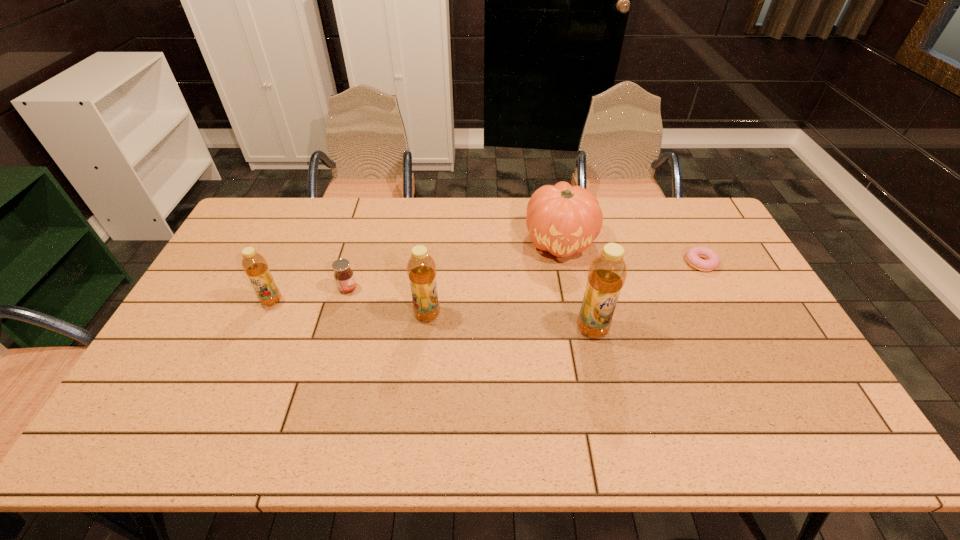
Where is `unoccupied position between the shortest bottle and the rightmost object`? The image size is (960, 540). unoccupied position between the shortest bottle and the rightmost object is located at coordinates (486, 281).

The image size is (960, 540). In order to click on free space between the second shortest object and the tallest bottle in this screenshot , I will do `click(470, 309)`.

Find the location of a particular element. free spot between the pumpkin and the second tallest object is located at coordinates (493, 278).

This screenshot has width=960, height=540. In order to click on object that stands as the fifth closest to the pumpkin in this screenshot , I will do `click(254, 264)`.

Image resolution: width=960 pixels, height=540 pixels. Identify the location of object that is the closest to the leftmost bottle. (343, 274).

This screenshot has height=540, width=960. What are the coordinates of `bottle that stands as the closest to the tallest bottle` in the screenshot? It's located at (421, 269).

Identify which bottle is the second closest to the second object from left to right. Please provide its 2D coordinates. Your answer should be formatted as a tuple, i.e. [(x, y)], where the tuple contains the x and y coordinates of a point satisfying the conditions above.

[(421, 269)]

At what (x,y) coordinates should I click in order to perform the action: click on blank space that satisfies the following two spatial constraints: 1. on the front side of the leftmost object; 2. on the left side of the rightmost bottle. Please return your answer as a coordinate pair (x, y). The height and width of the screenshot is (540, 960). Looking at the image, I should click on (259, 329).

Find the location of a particular element. vacant space that satisfies the following two spatial constraints: 1. on the carved face of the pumpkin; 2. on the label side of the fifth tallest object is located at coordinates (569, 288).

Identify the location of vacant space that satisfies the following two spatial constraints: 1. on the carved face of the pumpkin; 2. on the right side of the doughnut. The height and width of the screenshot is (540, 960). (564, 262).